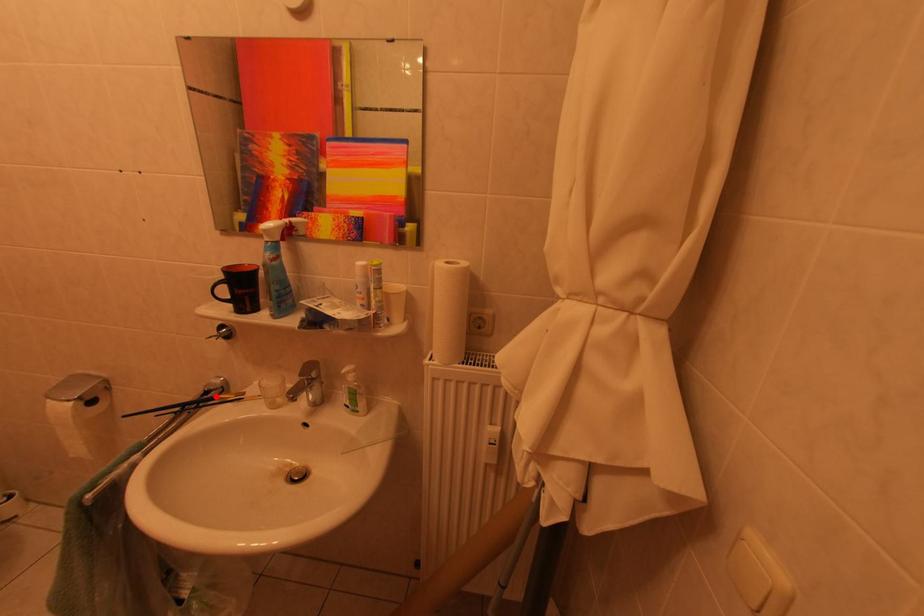
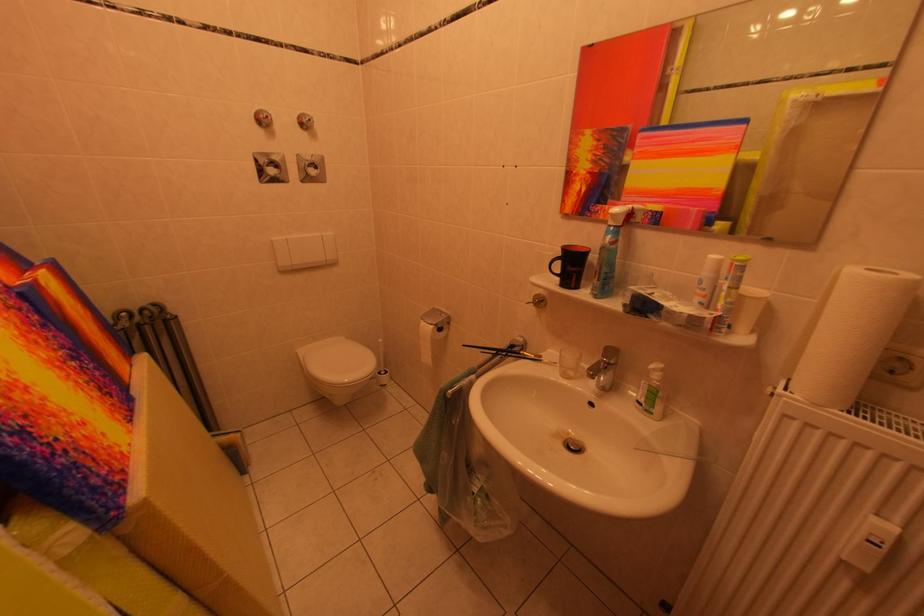
Where in the second image is the point corresponding to the highlighted location from the first image?

(520, 351)